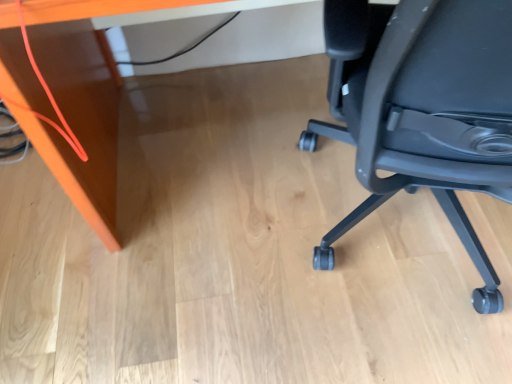
Question: Can you confirm if black plastic chair at right is positioned to the right of matte orange desk at upper left?

Choices:
 (A) yes
 (B) no

Answer: (A)

Question: Can you confirm if black plastic chair at right is wider than matte orange desk at upper left?

Choices:
 (A) no
 (B) yes

Answer: (B)

Question: Would you say matte orange desk at upper left is part of black plastic chair at right's contents?

Choices:
 (A) yes
 (B) no

Answer: (B)

Question: Would you say black plastic chair at right is outside matte orange desk at upper left?

Choices:
 (A) no
 (B) yes

Answer: (B)

Question: Is black plastic chair at right turned away from matte orange desk at upper left?

Choices:
 (A) yes
 (B) no

Answer: (B)

Question: Is there a large distance between black plastic chair at right and matte orange desk at upper left?

Choices:
 (A) no
 (B) yes

Answer: (A)

Question: Is matte orange desk at upper left at the right side of black plastic chair at right?

Choices:
 (A) no
 (B) yes

Answer: (A)

Question: Is matte orange desk at upper left taller than black plastic chair at right?

Choices:
 (A) no
 (B) yes

Answer: (A)

Question: From the image's perspective, is matte orange desk at upper left under black plastic chair at right?

Choices:
 (A) no
 (B) yes

Answer: (A)

Question: Is matte orange desk at upper left bigger than black plastic chair at right?

Choices:
 (A) no
 (B) yes

Answer: (B)

Question: Does matte orange desk at upper left contain black plastic chair at right?

Choices:
 (A) yes
 (B) no

Answer: (B)

Question: Is matte orange desk at upper left positioned in front of black plastic chair at right?

Choices:
 (A) no
 (B) yes

Answer: (A)

Question: Visually, is matte orange desk at upper left positioned to the left or to the right of black plastic chair at right?

Choices:
 (A) right
 (B) left

Answer: (B)